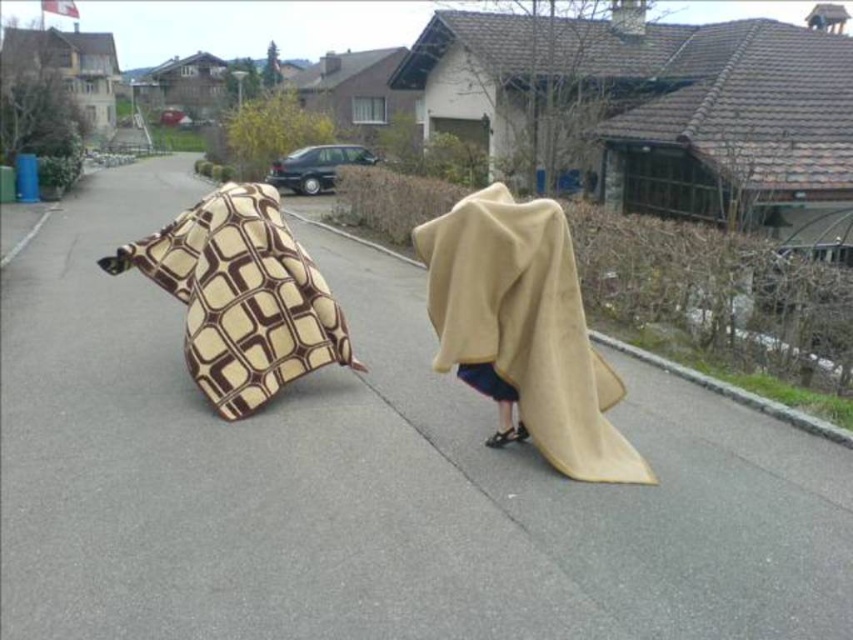
Question: Is beige fleece blanket at center positioned at the back of brown and beige patterned blanket at left?

Choices:
 (A) yes
 (B) no

Answer: (B)

Question: Among these objects, which one is farthest from the camera?

Choices:
 (A) brown and beige patterned blanket at left
 (B) beige fleece blanket at center

Answer: (A)

Question: Does beige fleece blanket at center appear over brown and beige patterned blanket at left?

Choices:
 (A) no
 (B) yes

Answer: (A)

Question: Is beige fleece blanket at center in front of brown and beige patterned blanket at left?

Choices:
 (A) no
 (B) yes

Answer: (B)